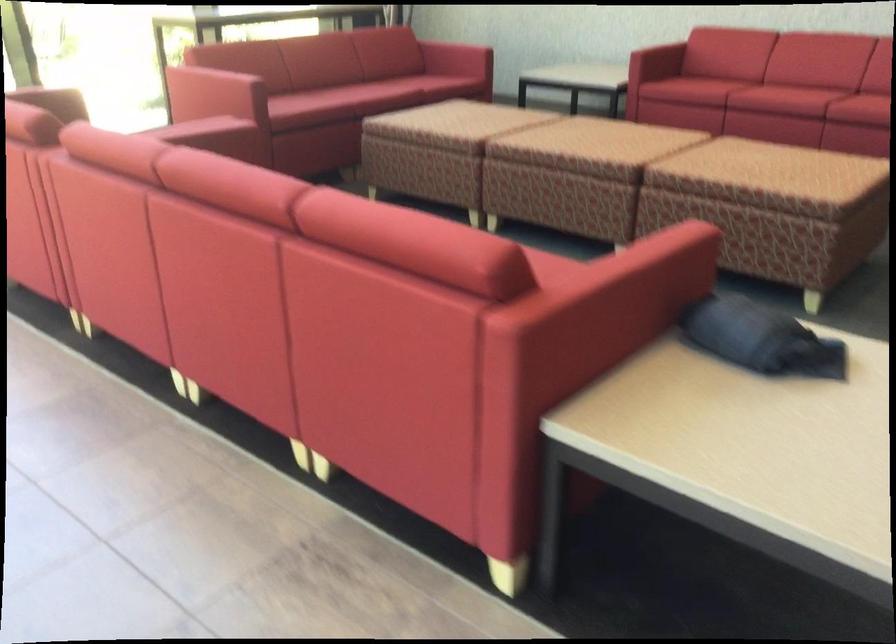
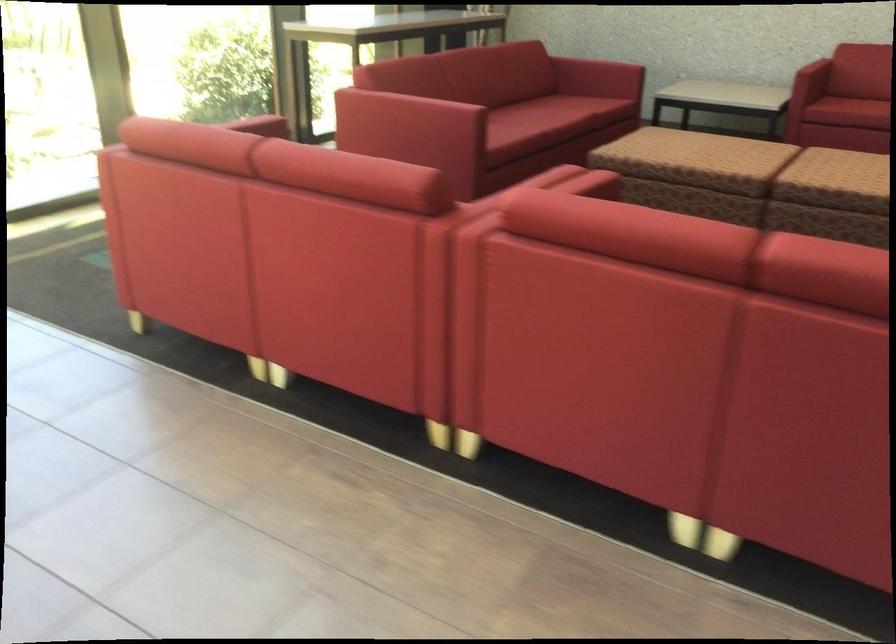
Question: In a continuous first-person perspective shot, in which direction is the camera moving?

Choices:
 (A) Left
 (B) Right
 (C) Forward
 (D) Backward

Answer: (D)